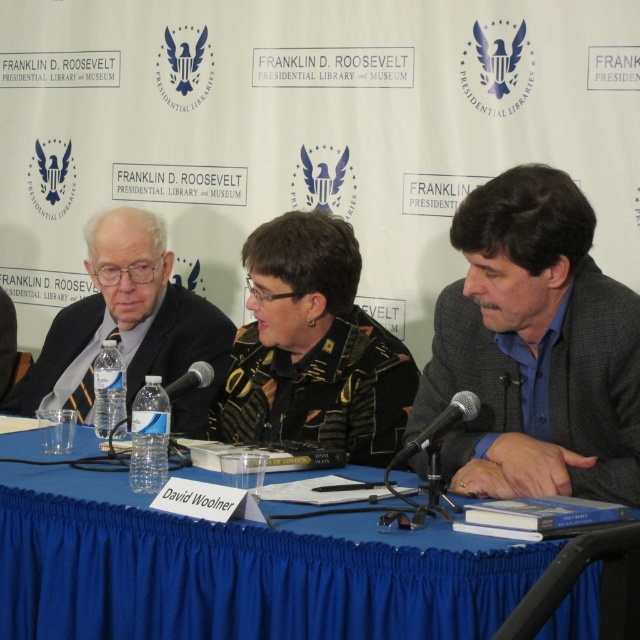
How distant is gray woolen suit at right from black plastic microphone at center?

gray woolen suit at right and black plastic microphone at center are 36.11 inches apart.

Is point (488, 310) more distant than point (198, 380)?

No, it is not.

The height and width of the screenshot is (640, 640). What do you see at coordinates (536, 348) in the screenshot? I see `gray woolen suit at right` at bounding box center [536, 348].

Locate an element on the screen. gray woolen suit at right is located at coordinates (536, 348).

Which is more to the left, blue fabric table at center or gray woolen suit at right?

blue fabric table at center is more to the left.

Which of these two, blue fabric table at center or gray woolen suit at right, stands taller?

gray woolen suit at right

Which is in front, point (76, 564) or point (604, 416)?

Point (76, 564)

This screenshot has width=640, height=640. Find the location of `blue fabric table at center`. blue fabric table at center is located at coordinates (237, 570).

Can you confirm if gray woolen suit at right is shorter than clear plastic water bottle at left?

No.

In the scene shown: How far apart are gray woolen suit at right and clear plastic water bottle at left?

A distance of 7.12 feet exists between gray woolen suit at right and clear plastic water bottle at left.

In order to click on gray woolen suit at right in this screenshot , I will do `click(536, 348)`.